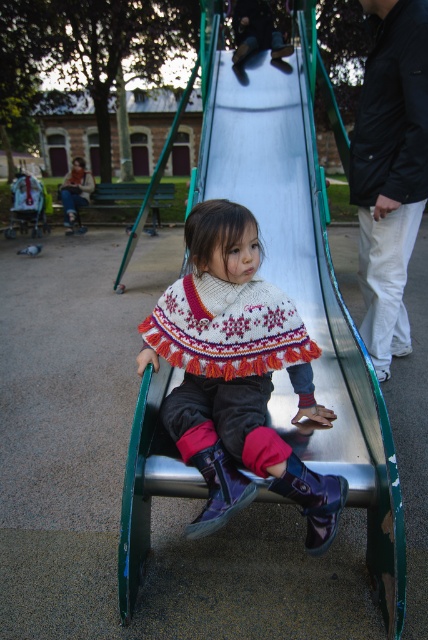
Question: Which of the following is the closest to the observer?

Choices:
 (A) metallic silver slide at center
 (B) black cotton sweater at upper right
 (C) knitted wool poncho at center

Answer: (A)

Question: Where is metallic silver slide at center located in relation to knitted wool poncho at center in the image?

Choices:
 (A) below
 (B) above

Answer: (B)

Question: Can you confirm if knitted wool poncho at center is smaller than black cotton sweater at upper right?

Choices:
 (A) yes
 (B) no

Answer: (B)

Question: Which of the following is the farthest from the observer?

Choices:
 (A) metallic silver slide at center
 (B) knitted wool poncho at center

Answer: (B)

Question: Is knitted wool poncho at center further to the viewer compared to black cotton sweater at upper right?

Choices:
 (A) no
 (B) yes

Answer: (A)

Question: Which object is the farthest from the black cotton sweater at upper right?

Choices:
 (A) metallic silver slide at center
 (B) knitted wool poncho at center

Answer: (A)